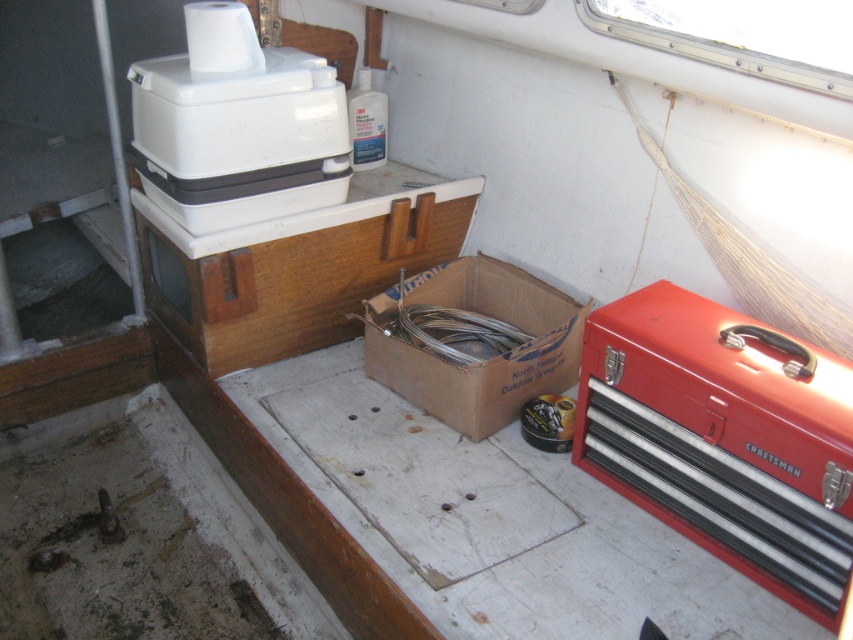
Is red metal toolbox at right shorter than white plastic cooler at upper left?

Incorrect, red metal toolbox at right's height does not fall short of white plastic cooler at upper left's.

Can you confirm if red metal toolbox at right is positioned above white plastic cooler at upper left?

No, red metal toolbox at right is not above white plastic cooler at upper left.

Is point (770, 435) more distant than point (195, 124)?

That is False.

Image resolution: width=853 pixels, height=640 pixels. In order to click on red metal toolbox at right in this screenshot , I will do `click(724, 436)`.

Is point (207, 220) farther from camera compared to point (412, 289)?

No, it is not.

Is white plastic cooler at upper left to the right of brown cardboard box at center from the viewer's perspective?

Incorrect, white plastic cooler at upper left is not on the right side of brown cardboard box at center.

Looking at this image, who is more distant from viewer, (260, 68) or (573, 368)?

Point (573, 368)

Identify the location of white plastic cooler at upper left. Image resolution: width=853 pixels, height=640 pixels. (236, 125).

Does red metal toolbox at right have a smaller size compared to brown cardboard box at center?

No.

What do you see at coordinates (724, 436) in the screenshot?
I see `red metal toolbox at right` at bounding box center [724, 436].

Find the location of a particular element. Image resolution: width=853 pixels, height=640 pixels. red metal toolbox at right is located at coordinates (724, 436).